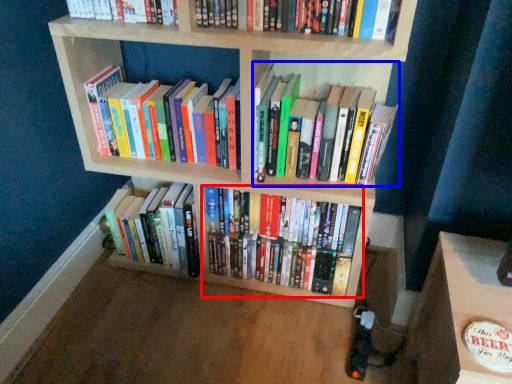
Question: Which point is further to the camera, book (highlighted by a red box) or book (highlighted by a blue box)?

Choices:
 (A) book
 (B) book

Answer: (A)